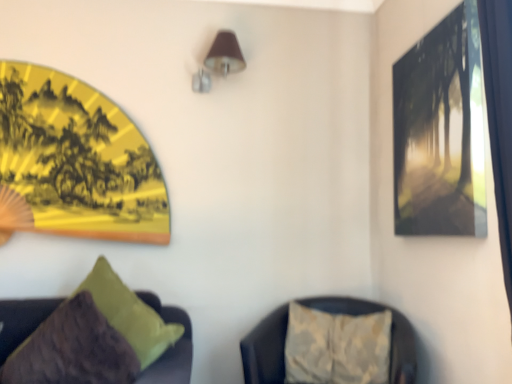
Question: Could textured beige cushion at lower right, marked as the 2th furniture in a left-to-right arrangement, be considered to be inside yellow paper fan at upper left, which appears as the first picture frame when viewed from the back?

Choices:
 (A) yes
 (B) no

Answer: (B)

Question: Is yellow paper fan at upper left, which appears as the first picture frame when viewed from the back, taller than textured beige cushion at lower right, marked as the 2th furniture in a left-to-right arrangement?

Choices:
 (A) no
 (B) yes

Answer: (B)

Question: From the image's perspective, is yellow paper fan at upper left, acting as the second picture frame starting from the front, below textured beige cushion at lower right, the 1th furniture positioned from the right?

Choices:
 (A) yes
 (B) no

Answer: (B)

Question: Is yellow paper fan at upper left, placed as the 2th picture frame when sorted from right to left, oriented towards textured beige cushion at lower right, marked as the 2th furniture in a left-to-right arrangement?

Choices:
 (A) yes
 (B) no

Answer: (B)

Question: Is yellow paper fan at upper left, acting as the second picture frame starting from the front, closer to camera compared to textured beige cushion at lower right, the 1th furniture positioned from the right?

Choices:
 (A) yes
 (B) no

Answer: (B)

Question: Does yellow paper fan at upper left, which appears as the first picture frame when viewed from the back, come behind textured beige cushion at lower right, the 1th furniture positioned from the right?

Choices:
 (A) yes
 (B) no

Answer: (A)

Question: Is brown fabric lampshade at upper center aimed at matte black picture frame at upper right, positioned as the 1th picture frame in front-to-back order?

Choices:
 (A) no
 (B) yes

Answer: (A)

Question: From the image's perspective, is brown fabric lampshade at upper center above matte black picture frame at upper right, which is counted as the second picture frame, starting from the back?

Choices:
 (A) no
 (B) yes

Answer: (B)

Question: Is matte black picture frame at upper right, the first picture frame viewed from the right, inside brown fabric lampshade at upper center?

Choices:
 (A) no
 (B) yes

Answer: (A)

Question: Is brown fabric lampshade at upper center behind matte black picture frame at upper right, which is counted as the second picture frame, starting from the back?

Choices:
 (A) yes
 (B) no

Answer: (A)

Question: From a real-world perspective, is brown fabric lampshade at upper center over matte black picture frame at upper right, positioned as the 2th picture frame in left-to-right order?

Choices:
 (A) yes
 (B) no

Answer: (A)

Question: Is brown fabric lampshade at upper center in front of matte black picture frame at upper right, positioned as the 2th picture frame in left-to-right order?

Choices:
 (A) yes
 (B) no

Answer: (B)

Question: Is textured beige cushion at lower right, marked as the 2th furniture in a left-to-right arrangement, positioned with its back to matte black picture frame at upper right, which is counted as the second picture frame, starting from the back?

Choices:
 (A) no
 (B) yes

Answer: (A)